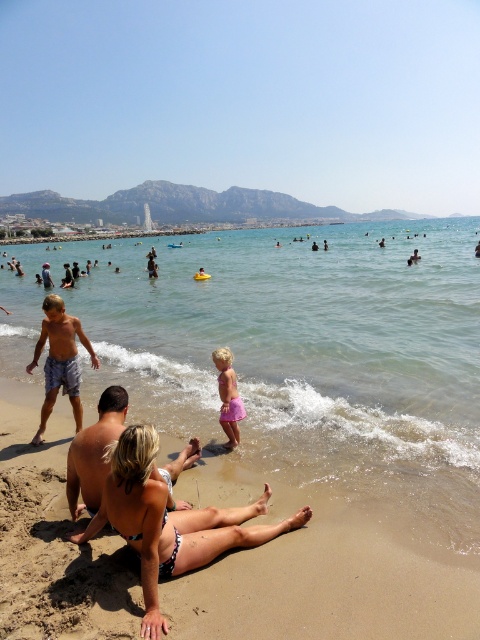
Question: In this image, where is white bikini bottom at lower center located relative to matte blue shorts at left?

Choices:
 (A) right
 (B) left

Answer: (A)

Question: Which point is farther to the camera?

Choices:
 (A) (127, 614)
 (B) (379, 314)

Answer: (B)

Question: Which point is farther to the camera?

Choices:
 (A) brown sandy beach at lower center
 (B) matte blue shorts at left

Answer: (B)

Question: Does white bikini bottom at lower center have a larger size compared to pink fabric skirt at center?

Choices:
 (A) no
 (B) yes

Answer: (B)

Question: Is matte blue shorts at left wider than pink fabric skirt at center?

Choices:
 (A) no
 (B) yes

Answer: (B)

Question: Which point is closer to the camera?

Choices:
 (A) (283, 289)
 (B) (148, 609)

Answer: (B)